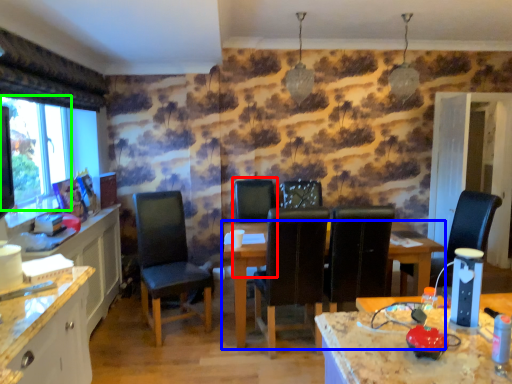
Question: Which object is positioned farthest from armchair (highlighted by a red box)? Select from table (highlighted by a blue box) and window screen (highlighted by a green box).

Choices:
 (A) table
 (B) window screen

Answer: (B)